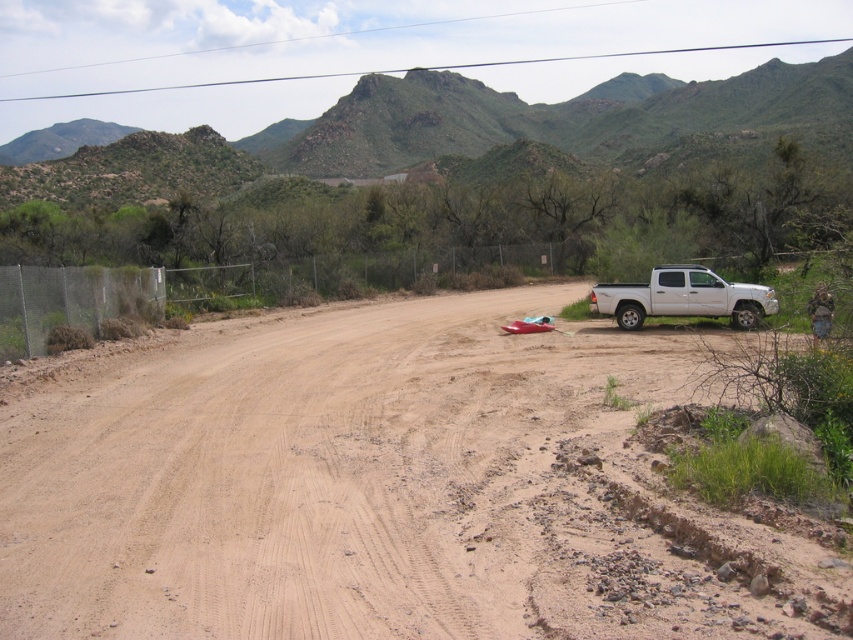
Is green textured mountain at upper center to the left of white matte truck at right from the viewer's perspective?

Indeed, green textured mountain at upper center is positioned on the left side of white matte truck at right.

Does green textured mountain at upper center have a lesser width compared to white matte truck at right?

In fact, green textured mountain at upper center might be wider than white matte truck at right.

Who is more distant from viewer, [456,106] or [758,317]?

The point [456,106] is more distant.

This screenshot has width=853, height=640. I want to click on green textured mountain at upper center, so click(x=553, y=115).

Is point (120, 508) farther from viewer compared to point (680, 131)?

That is False.

From the picture: Is dull brown dirt at center smaller than green textured mountain at upper center?

Correct, dull brown dirt at center occupies less space than green textured mountain at upper center.

The image size is (853, 640). Identify the location of dull brown dirt at center. (381, 486).

Does point (10, 580) come behind point (697, 291)?

No.

Between point (824, 563) and point (749, 310), which one is positioned in front?

Point (824, 563) is in front.

Where is `dull brown dirt at center`? This screenshot has width=853, height=640. dull brown dirt at center is located at coordinates (381, 486).